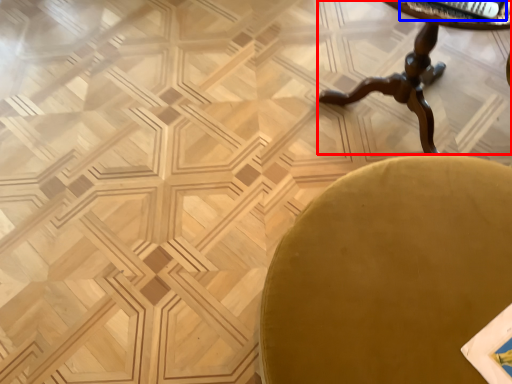
Question: Which of the following is the closest to the observer, table (highlighted by a red box) or magazine (highlighted by a blue box)?

Choices:
 (A) table
 (B) magazine

Answer: (A)